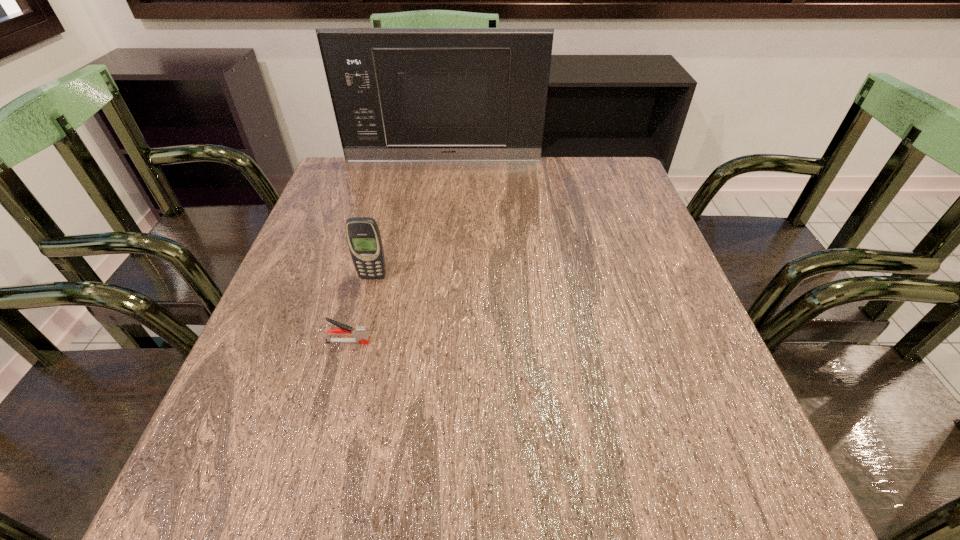
Find the location of a particular element. Image resolution: width=960 pixels, height=540 pixels. microwave oven is located at coordinates [x=399, y=94].

Where is `the tallest object`? The width and height of the screenshot is (960, 540). the tallest object is located at coordinates (399, 94).

The image size is (960, 540). Identify the location of cellular telephone. (363, 236).

Find the location of `the second shortest object`. the second shortest object is located at coordinates (363, 236).

Image resolution: width=960 pixels, height=540 pixels. Find the location of `the nearest object`. the nearest object is located at coordinates (360, 333).

Locate an element on the screen. stapler is located at coordinates (360, 333).

Image resolution: width=960 pixels, height=540 pixels. In order to click on vacant space located 0.310m on the front panel of the farthest object in this screenshot , I will do `click(436, 225)`.

At what (x,y) coordinates should I click in order to perform the action: click on free space located 0.200m on the screen of the second farthest object. Please return your answer as a coordinate pair (x, y). This screenshot has width=960, height=540. Looking at the image, I should click on (353, 355).

Find the location of a particular element. The width and height of the screenshot is (960, 540). blank space located on the handle side of the nearest object is located at coordinates (474, 342).

Where is `object located in the far edge section of the desktop`? object located in the far edge section of the desktop is located at coordinates (399, 94).